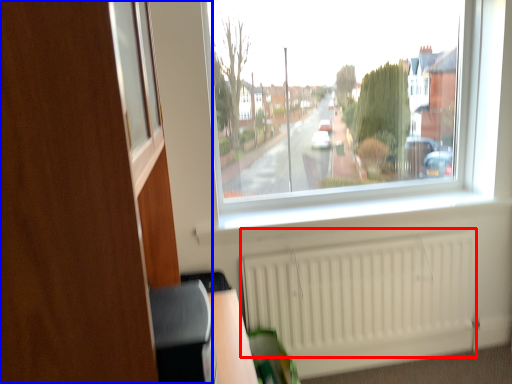
Question: Which object is further to the camera taking this photo, radiator (highlighted by a red box) or dresser (highlighted by a blue box)?

Choices:
 (A) radiator
 (B) dresser

Answer: (A)